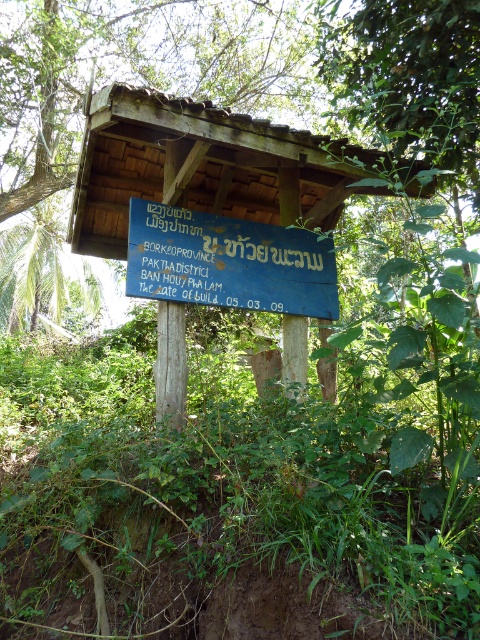
Does wooden signboard at center come behind blue painted wood sign at center?

No, it is in front of blue painted wood sign at center.

Can you confirm if wooden signboard at center is positioned to the left of blue painted wood sign at center?

Indeed, wooden signboard at center is positioned on the left side of blue painted wood sign at center.

Is point (146, 108) farther from camera compared to point (152, 282)?

No, it is in front of (152, 282).

Find the location of a particular element. This screenshot has height=640, width=480. wooden signboard at center is located at coordinates (200, 164).